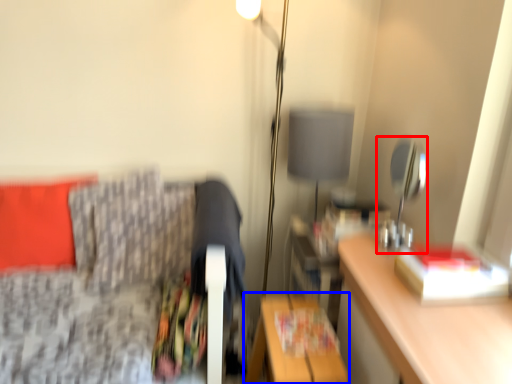
Question: Which of the following is the closest to the observer, table lamp (highlighted by a red box) or table (highlighted by a blue box)?

Choices:
 (A) table lamp
 (B) table

Answer: (B)